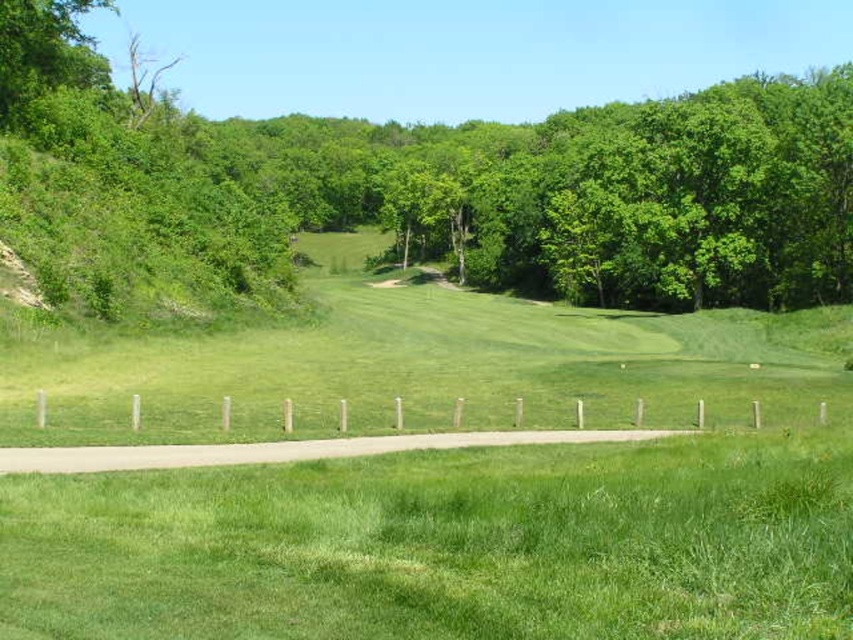
Is green leafy tree at center taller than green grass at lower center?

Yes, green leafy tree at center is taller than green grass at lower center.

Does green leafy tree at center appear over green grass at lower center?

Correct, green leafy tree at center is located above green grass at lower center.

Find the location of a particular element. green leafy tree at center is located at coordinates (421, 188).